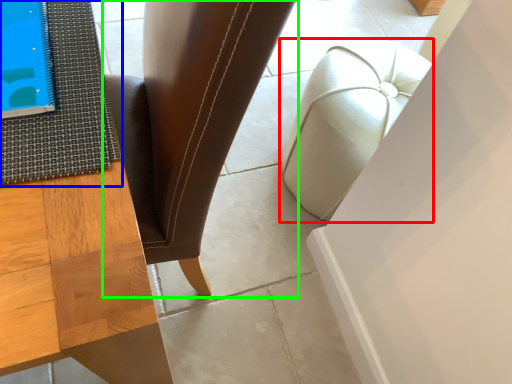
Question: Which object is the closest to the furniture (highlighted by a red box)? Choose among these: mat (highlighted by a blue box) or chair (highlighted by a green box).

Choices:
 (A) mat
 (B) chair

Answer: (B)